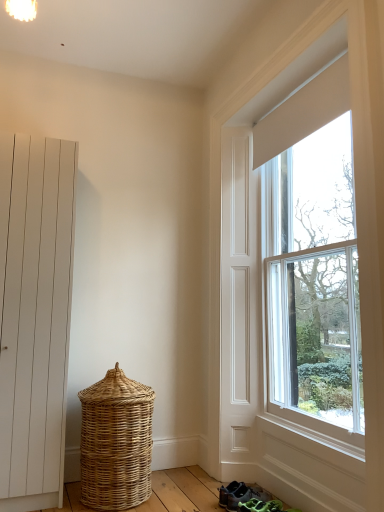
Question: Should I look upward or downward to see gray fabric sneakers at lower center?

Choices:
 (A) up
 (B) down

Answer: (B)

Question: Would you consider white matte door at left to be distant from gray fabric sneakers at lower center?

Choices:
 (A) yes
 (B) no

Answer: (A)

Question: From a real-world perspective, is white matte door at left over gray fabric sneakers at lower center?

Choices:
 (A) no
 (B) yes

Answer: (B)

Question: From the image's perspective, would you say white matte door at left is positioned over gray fabric sneakers at lower center?

Choices:
 (A) yes
 (B) no

Answer: (A)

Question: Can you confirm if white matte door at left is thinner than gray fabric sneakers at lower center?

Choices:
 (A) yes
 (B) no

Answer: (B)

Question: Is white matte door at left to the right of gray fabric sneakers at lower center from the viewer's perspective?

Choices:
 (A) yes
 (B) no

Answer: (B)

Question: Is white matte door at left turned away from gray fabric sneakers at lower center?

Choices:
 (A) yes
 (B) no

Answer: (B)

Question: Is gray fabric sneakers at lower center not near white matte door at left?

Choices:
 (A) yes
 (B) no

Answer: (A)

Question: From a real-world perspective, is gray fabric sneakers at lower center below white matte door at left?

Choices:
 (A) yes
 (B) no

Answer: (A)

Question: From a real-world perspective, is gray fabric sneakers at lower center over white matte door at left?

Choices:
 (A) no
 (B) yes

Answer: (A)

Question: Is gray fabric sneakers at lower center thinner than white matte door at left?

Choices:
 (A) no
 (B) yes

Answer: (B)

Question: Can you confirm if gray fabric sneakers at lower center is taller than white matte door at left?

Choices:
 (A) no
 (B) yes

Answer: (A)

Question: Is gray fabric sneakers at lower center at the left side of white matte door at left?

Choices:
 (A) yes
 (B) no

Answer: (B)

Question: Is white matte door at left directly adjacent to clear glass window at right?

Choices:
 (A) no
 (B) yes

Answer: (A)